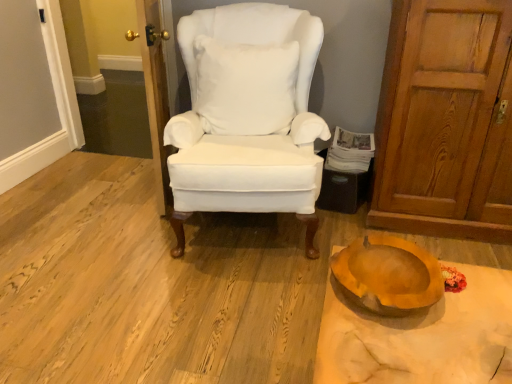
Question: Looking at their shapes, would you say wooden door at left, which is counted as the second door, starting from the right, is wider or thinner than wooden door at right, arranged as the first door when viewed from the right?

Choices:
 (A) wide
 (B) thin

Answer: (B)

Question: From a real-world perspective, relative to wooden door at right, the second door positioned from the left, is wooden door at left, the 1th door positioned from the left, vertically above or below?

Choices:
 (A) above
 (B) below

Answer: (B)

Question: Estimate the real-world distances between objects in this image. Which object is closer to the wooden door at left, the 1th door positioned from the left?

Choices:
 (A) white fluffy pillow at center
 (B) matte orange bowl at lower right
 (C) wooden door at right, arranged as the first door when viewed from the right
 (D) wooden bowl at lower right
 (E) white fabric chair at center

Answer: (A)

Question: Which object is the closest to the wooden door at left, the 1th door positioned from the left?

Choices:
 (A) white paper magazine at right
 (B) white fabric chair at center
 (C) white fluffy pillow at center
 (D) wooden door at right, the second door positioned from the left
 (E) matte orange bowl at lower right

Answer: (C)